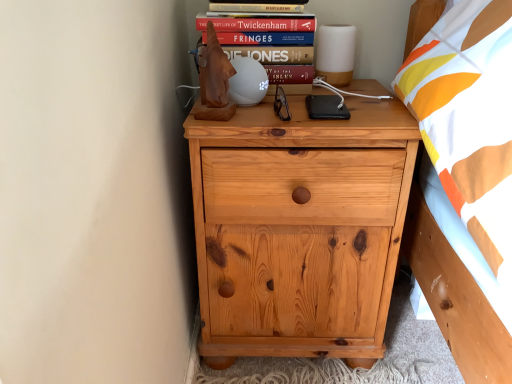
The image size is (512, 384). In order to click on hardcover book at upper center in this screenshot , I will do `click(258, 24)`.

The width and height of the screenshot is (512, 384). I want to click on chest of drawers on the right of the hardcover book at upper center, so click(x=298, y=229).

Is natural wood chest of drawers at center oriented towards hardcover book at upper center?

No, natural wood chest of drawers at center does not turn towards hardcover book at upper center.

Can you see natural wood chest of drawers at center touching hardcover book at upper center?

No, natural wood chest of drawers at center is not making contact with hardcover book at upper center.

From the picture: Looking at their sizes, would you say natural wood chest of drawers at center is wider or thinner than hardcover book at upper center?

Considering their sizes, natural wood chest of drawers at center looks broader than hardcover book at upper center.

From the image's perspective, is natural wood chest of drawers at center located beneath hardcover book at upper center?

Yes, from the image's perspective, natural wood chest of drawers at center is below hardcover book at upper center.

From a real-world perspective, is natural wood chest of drawers at center physically above hardcover book at upper center?

No, from a real-world perspective, natural wood chest of drawers at center is not over hardcover book at upper center

Is natural wood chest of drawers at center facing away from hardcover book at upper center?

That's not correct — natural wood chest of drawers at center is not looking away from hardcover book at upper center.

Could you tell me if hardcover book at upper center is turned towards natural wood chest of drawers at center?

No, hardcover book at upper center is not turned towards natural wood chest of drawers at center.

Is hardcover book at upper center smaller than natural wood chest of drawers at center?

Correct, hardcover book at upper center occupies less space than natural wood chest of drawers at center.

Looking at this image, does hardcover book at upper center appear on the right side of natural wood chest of drawers at center?

No, hardcover book at upper center is not to the right of natural wood chest of drawers at center.

At what (x,y) coordinates should I click in order to perform the action: click on book positioned vertically above the natural wood chest of drawers at center (from a real-world perspective). Please return your answer as a coordinate pair (x, y). Looking at the image, I should click on (258, 24).

In the scene shown: Is hardcover book at upper center turned away from hardcover book at upper center?

No, hardcover book at upper center's orientation is not away from hardcover book at upper center.

Considering the sizes of objects hardcover book at upper center and hardcover book at upper center in the image provided, who is bigger, hardcover book at upper center or hardcover book at upper center?

Bigger between the two is hardcover book at upper center.

From their relative heights in the image, would you say hardcover book at upper center is taller or shorter than hardcover book at upper center?

In the image, hardcover book at upper center appears to be shorter than hardcover book at upper center.

What's the angular difference between hardcover book at upper center and natural wood chest of drawers at center's facing directions?

The angle between the facing direction of hardcover book at upper center and the facing direction of natural wood chest of drawers at center is 6.2 degrees.

Which object is thinner, hardcover book at upper center or natural wood chest of drawers at center?

With smaller width is hardcover book at upper center.

Considering the positions of point (234, 6) and point (295, 174), is point (234, 6) closer or farther from the camera than point (295, 174)?

Point (234, 6).

Can you confirm if hardcover book at upper center is shorter than natural wood chest of drawers at center?

Indeed, hardcover book at upper center has a lesser height compared to natural wood chest of drawers at center.

From a real-world perspective, is hardcover book at upper center below hardcover book at upper center?

Correct, in the physical world, hardcover book at upper center is lower than hardcover book at upper center.

Considering the sizes of objects hardcover book at upper center and hardcover book at upper center in the image provided, who is bigger, hardcover book at upper center or hardcover book at upper center?

A: hardcover book at upper center is bigger.

Considering the sizes of objects hardcover book at upper center and hardcover book at upper center in the image provided, who is shorter, hardcover book at upper center or hardcover book at upper center?

hardcover book at upper center.

Identify the location of paperback book on the left of the natural wood chest of drawers at center. This screenshot has height=384, width=512. pyautogui.click(x=257, y=6).

I want to click on book above the natural wood chest of drawers at center (from the image's perspective), so click(x=258, y=24).

Looking at the image, which one is located further to hardcover book at upper center, natural wood chest of drawers at center or hardcover book at upper center?

The object further to hardcover book at upper center is natural wood chest of drawers at center.

Estimate the real-world distances between objects in this image. Which object is further from hardcover book at upper center, hardcover book at upper center or natural wood chest of drawers at center?

natural wood chest of drawers at center lies further to hardcover book at upper center than the other object.

From the image, which object appears to be nearer to hardcover book at upper center, natural wood chest of drawers at center or hardcover book at upper center?

hardcover book at upper center is positioned closer to the anchor hardcover book at upper center.

Based on their spatial positions, is hardcover book at upper center or hardcover book at upper center further from natural wood chest of drawers at center?

hardcover book at upper center is further to natural wood chest of drawers at center.

Based on their spatial positions, is hardcover book at upper center or natural wood chest of drawers at center further from hardcover book at upper center?

natural wood chest of drawers at center.

Considering their positions, is hardcover book at upper center positioned further to natural wood chest of drawers at center than hardcover book at upper center?

Based on the image, hardcover book at upper center appears to be further to natural wood chest of drawers at center.

The width and height of the screenshot is (512, 384). I want to click on book between hardcover book at upper center and natural wood chest of drawers at center vertically, so click(x=258, y=24).